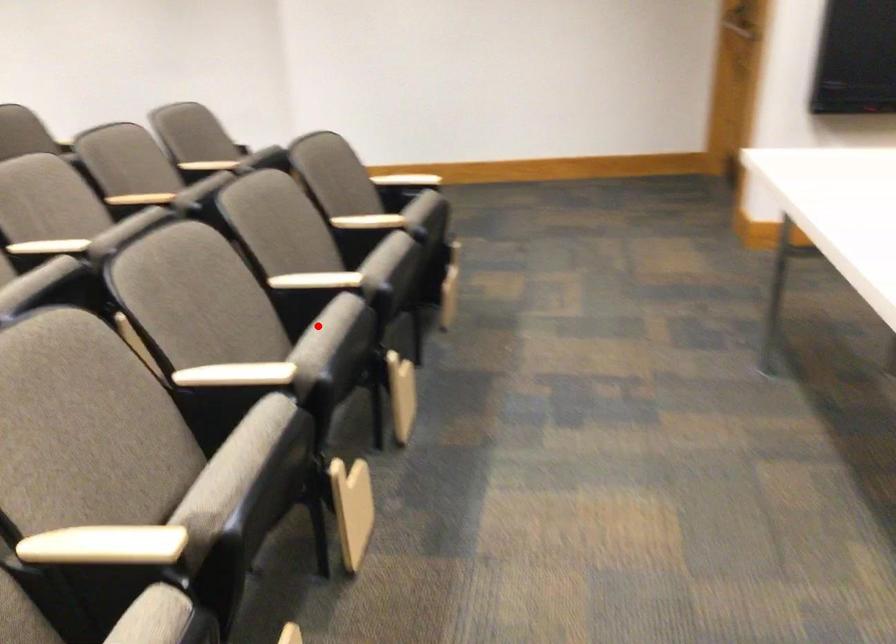
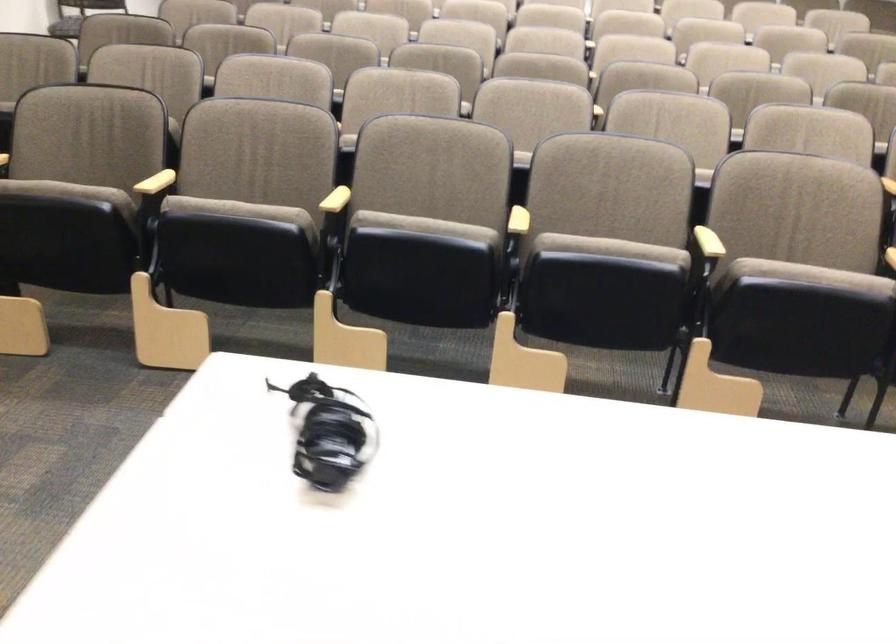
Question: A red point is marked in image1. In image2, is the corresponding 3D point closer to the camera or farther? Reply with the corresponding letter.

Choices:
 (A) The corresponding 3D point is closer.
 (B) The corresponding 3D point is farther.

Answer: (B)